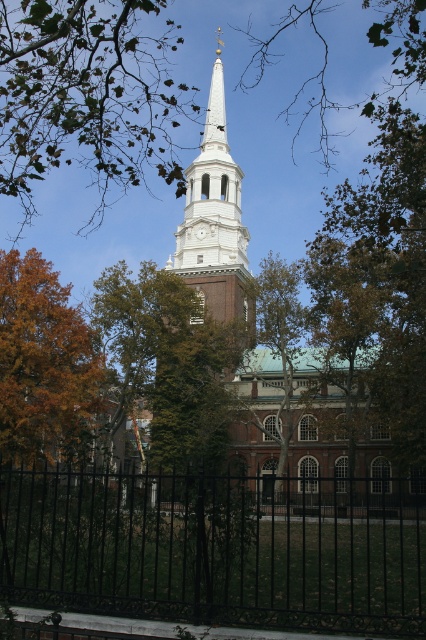
You are a photographer standing in front of the church. You want to capture a clear view of the white glossy steeple at upper center without the black wrought iron fence at lower center blocking it. What should you do?

The black wrought iron fence at lower center is below the white glossy steeple at upper center. To avoid the fence blocking the steeple, you should position yourself or adjust your camera angle to look upward so the steeple remains visible above the fence.

You are standing in front of the church and want to take a photo that includes both the orange leafy tree at left and the white glossy steeple at upper center. Which object should you frame first in your camera to ensure both are fully visible?

You should frame the orange leafy tree at left first because it is larger in size than the white glossy steeple at upper center, so ensuring it fits will help accommodate the smaller steeple within the frame.

You are standing in front of the church and want to take a photo of the orange leafy tree at left. Where exactly should you look to capture it in your camera viewfinder?

The orange leafy tree at left is located at the coordinates point [45,365], so you should aim your camera towards that position to capture it.